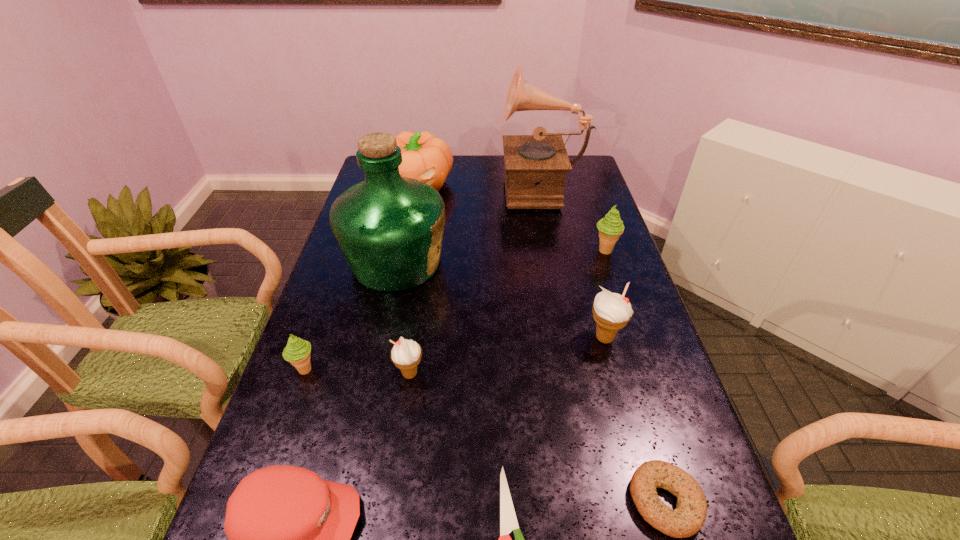
The width and height of the screenshot is (960, 540). Find the location of `the smaller green icecream`. the smaller green icecream is located at coordinates (297, 352).

You are a GUI agent. You are given a task and a screenshot of the screen. Output one action in this format:
    pyautogui.click(x=<x>, y=<y>)
    Task: Click on the free space located on the horn of the record player
    This screenshot has width=960, height=540.
    Given the screenshot: What is the action you would take?
    pyautogui.click(x=454, y=187)

At what (x,y) coordinates should I click in order to perform the action: click on vacant point located on the horn of the record player. Please return your answer as a coordinate pair (x, y). Image resolution: width=960 pixels, height=540 pixels. Looking at the image, I should click on (427, 187).

The width and height of the screenshot is (960, 540). In order to click on vacant position located on the horn of the record player in this screenshot , I will do `click(430, 187)`.

Image resolution: width=960 pixels, height=540 pixels. I want to click on free space located 0.370m on the label side of the liquor, so pos(573,262).

In order to click on vacant space located 0.370m on the carved face of the eighth shortest object in this screenshot , I will do `click(398, 275)`.

The image size is (960, 540). Find the location of `vacant space located 0.100m on the back of the bigger green icecream`. vacant space located 0.100m on the back of the bigger green icecream is located at coordinates (596, 224).

The width and height of the screenshot is (960, 540). I want to click on free space located 0.280m on the left of the sixth nearest object, so click(473, 338).

Locate an element on the screen. The image size is (960, 540). vacant region located 0.310m on the right of the smaller white icecream is located at coordinates (560, 374).

You are a GUI agent. You are given a task and a screenshot of the screen. Output one action in this format:
    pyautogui.click(x=<x>, y=<y>)
    Task: Click on the free space located on the back of the leftmost icecream
    Image resolution: width=960 pixels, height=540 pixels.
    Given the screenshot: What is the action you would take?
    pyautogui.click(x=344, y=259)